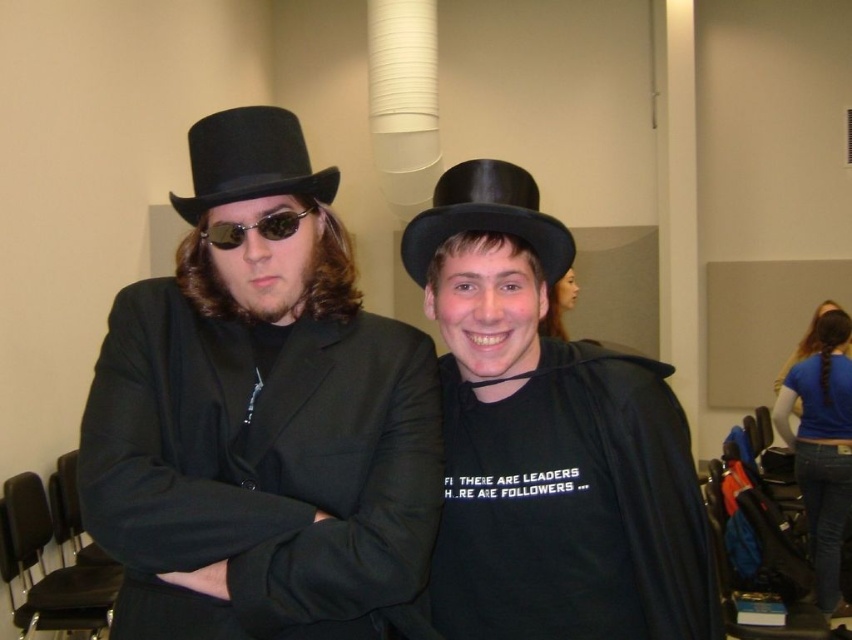
Who is positioned more to the right, matte black top hat at center or black felt fedora at left?

matte black top hat at center

Based on the photo, who is more distant from viewer, (83, 516) or (308, 188)?

The point (308, 188) is behind.

Locate an element on the screen. The height and width of the screenshot is (640, 852). matte black top hat at center is located at coordinates (262, 420).

From the picture: Does matte black hat at center appear on the right side of matte black sunglasses at center?

Indeed, matte black hat at center is positioned on the right side of matte black sunglasses at center.

Who is more distant from viewer, [580,620] or [233,224]?

The point [580,620] is behind.

Is point (436, 237) less distant than point (197, 227)?

No, (436, 237) is behind (197, 227).

The height and width of the screenshot is (640, 852). I want to click on matte black hat at center, so click(x=548, y=442).

Is black felt fedora at left behind matte black sunglasses at center?

No, it is in front of matte black sunglasses at center.

Is black felt fedora at left bigger than matte black sunglasses at center?

Correct, black felt fedora at left is larger in size than matte black sunglasses at center.

Locate an element on the screen. black felt fedora at left is located at coordinates (249, 161).